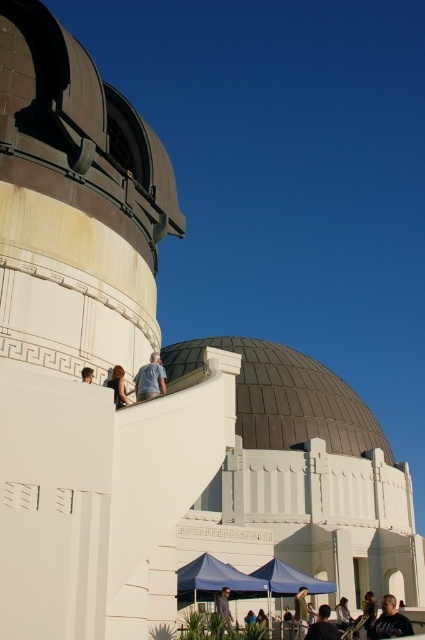
Does dark gray metallic dome at center have a smaller size compared to light brown leather jacket at center?

No, dark gray metallic dome at center is not smaller than light brown leather jacket at center.

Which is behind, point (272, 387) or point (297, 625)?

The point (272, 387) is behind.

Is point (268, 445) closer to camera compared to point (295, 625)?

No, (268, 445) is further to viewer.

Locate an element on the screen. This screenshot has height=640, width=425. dark gray metallic dome at center is located at coordinates (286, 397).

Between light brown leather jacket at center and light brown hair at upper center, which one has more height?

With more height is light brown leather jacket at center.

Between point (306, 618) and point (112, 376), which one is positioned in front?

Point (112, 376)

What are the coordinates of `light brown leather jacket at center` in the screenshot? It's located at (300, 612).

Which is behind, point (122, 396) or point (221, 589)?

The point (221, 589) is more distant.

Find the location of a particular element. The height and width of the screenshot is (640, 425). light brown hair at upper center is located at coordinates (118, 387).